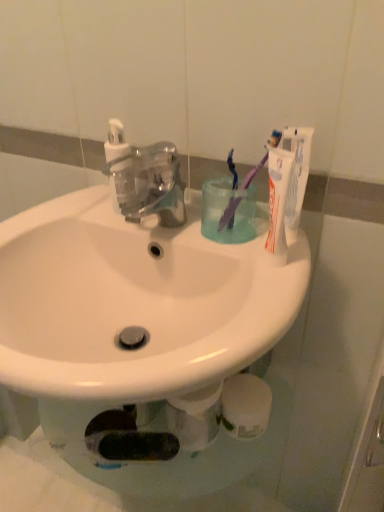
At what (x,y) coordinates should I click in order to perform the action: click on free space in front of purple plastic toothbrush at upper right, the 1th toothbrush when ordered from left to right. Please return your answer as a coordinate pair (x, y). Looking at the image, I should click on (254, 271).